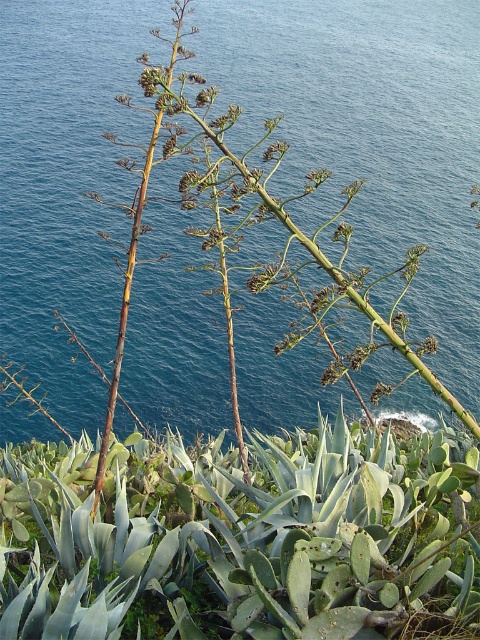
Can you confirm if blue liquid water at center is taller than green succulent at center?

Yes, blue liquid water at center is taller than green succulent at center.

Who is shorter, blue liquid water at center or green succulent at center?

green succulent at center

Image resolution: width=480 pixels, height=640 pixels. I want to click on blue liquid water at center, so coord(370,138).

In order to click on blue liquid water at center in this screenshot , I will do `click(370, 138)`.